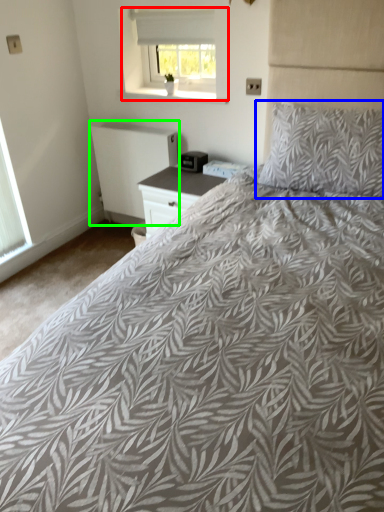
Question: Estimate the real-world distances between objects in this image. Which object is closer to window (highlighted by a red box), pillow (highlighted by a blue box) or radiator (highlighted by a green box)?

Choices:
 (A) pillow
 (B) radiator

Answer: (B)